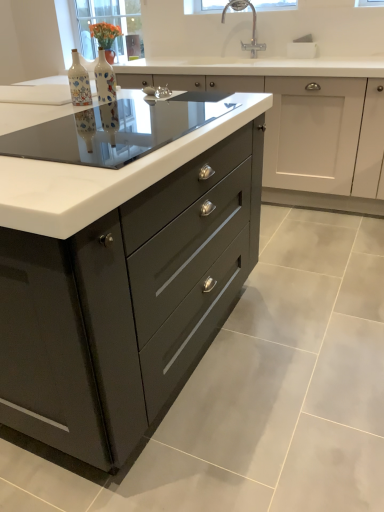
Question: Is glossy dark gray cabinet at center, the first cabinetry viewed from the front, taller than decorative ceramic bottle at center, the 2th bottle viewed from the right?

Choices:
 (A) no
 (B) yes

Answer: (B)

Question: Can you confirm if glossy dark gray cabinet at center, the first cabinetry viewed from the front, is positioned to the left of decorative ceramic bottle at center, which is the 1th bottle in left-to-right order?

Choices:
 (A) no
 (B) yes

Answer: (B)

Question: Would you consider glossy dark gray cabinet at center, the first cabinetry viewed from the front, to be distant from decorative ceramic bottle at center, the 2th bottle viewed from the right?

Choices:
 (A) no
 (B) yes

Answer: (A)

Question: Is glossy dark gray cabinet at center, the first cabinetry viewed from the front, surrounding decorative ceramic bottle at center, which is the 1th bottle in left-to-right order?

Choices:
 (A) yes
 (B) no

Answer: (B)

Question: From a real-world perspective, is glossy dark gray cabinet at center, marked as the second cabinetry in a back-to-front arrangement, beneath decorative ceramic bottle at center, the 2th bottle viewed from the right?

Choices:
 (A) yes
 (B) no

Answer: (A)

Question: Relative to glossy dark gray cabinet at center, the first cabinetry viewed from the front, is clear glass window screen at upper center, which is counted as the first window screen, starting from the right, in front or behind?

Choices:
 (A) behind
 (B) front

Answer: (A)

Question: From a real-world perspective, is clear glass window screen at upper center, which is counted as the first window screen, starting from the right, physically located above or below glossy dark gray cabinet at center, the first cabinetry viewed from the front?

Choices:
 (A) above
 (B) below

Answer: (A)

Question: Looking at their shapes, would you say clear glass window screen at upper center, which is counted as the first window screen, starting from the right, is wider or thinner than glossy dark gray cabinet at center, marked as the second cabinetry in a back-to-front arrangement?

Choices:
 (A) thin
 (B) wide

Answer: (A)

Question: Is clear glass window screen at upper center, which is counted as the first window screen, starting from the right, spatially inside glossy dark gray cabinet at center, the first cabinetry viewed from the front, or outside of it?

Choices:
 (A) inside
 (B) outside

Answer: (B)

Question: Is glossy dark gray cabinet at center, marked as the second cabinetry in a back-to-front arrangement, wider or thinner than transparent glass table at center?

Choices:
 (A) wide
 (B) thin

Answer: (A)

Question: Do you think glossy dark gray cabinet at center, marked as the second cabinetry in a back-to-front arrangement, is within transparent glass table at center, or outside of it?

Choices:
 (A) outside
 (B) inside

Answer: (A)

Question: Based on their positions, is glossy dark gray cabinet at center, the first cabinetry viewed from the front, located to the left or right of transparent glass table at center?

Choices:
 (A) right
 (B) left

Answer: (B)

Question: Relative to transparent glass table at center, is glossy dark gray cabinet at center, marked as the second cabinetry in a back-to-front arrangement, in front or behind?

Choices:
 (A) front
 (B) behind

Answer: (A)

Question: In terms of height, does matte ceramic vase at center, which is the 1th bottle in right-to-left order, look taller or shorter compared to glossy dark gray cabinet at center, marked as the second cabinetry in a back-to-front arrangement?

Choices:
 (A) tall
 (B) short

Answer: (B)

Question: Is matte ceramic vase at center, which is the 1th bottle in right-to-left order, situated inside glossy dark gray cabinet at center, the first cabinetry viewed from the front, or outside?

Choices:
 (A) inside
 (B) outside

Answer: (B)